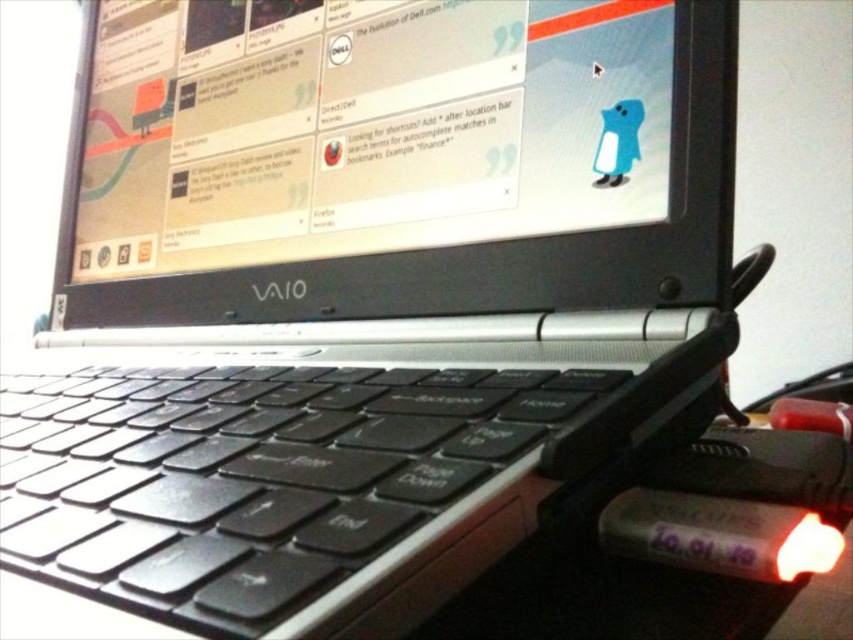
From the picture: Is matte black laptop at center taller than black matte keyboard at center?

Indeed, matte black laptop at center has a greater height compared to black matte keyboard at center.

Does matte black laptop at center appear over black matte keyboard at center?

Yes.

Locate an element on the screen. The height and width of the screenshot is (640, 853). matte black laptop at center is located at coordinates pyautogui.click(x=395, y=160).